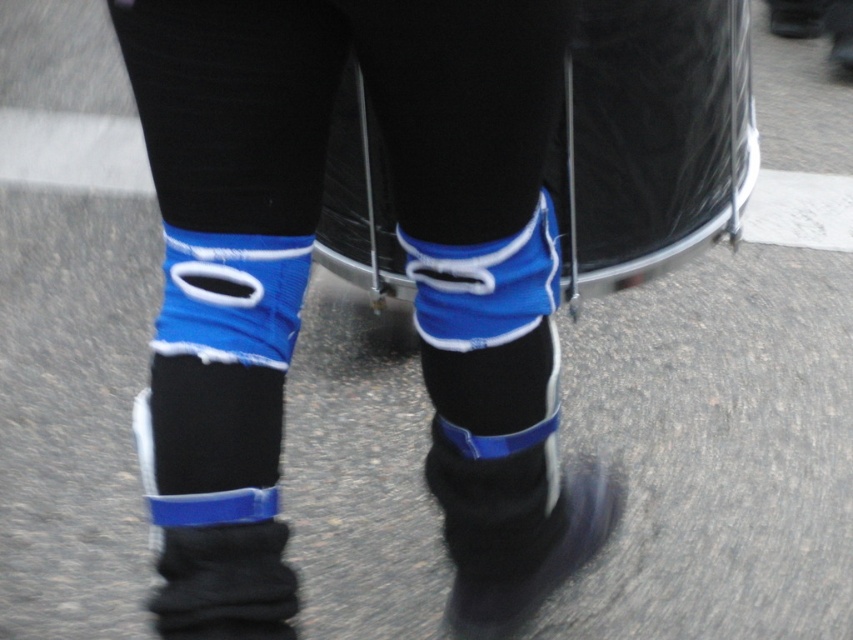
Question: Does blue fabric leg warmers at center appear on the right side of black knitted socks at lower left?

Choices:
 (A) yes
 (B) no

Answer: (A)

Question: Which point is closer to the camera taking this photo?

Choices:
 (A) (467, 368)
 (B) (577, 467)
 (C) (213, 552)

Answer: (C)

Question: Which of the following is the closest to the observer?

Choices:
 (A) blue fabric leg warmers at center
 (B) black knitted socks at lower left

Answer: (A)

Question: Does black knitted socks at lower left appear under black matte boot at lower center?

Choices:
 (A) yes
 (B) no

Answer: (B)

Question: Is blue fabric leg warmers at center to the right of black matte boot at lower center from the viewer's perspective?

Choices:
 (A) no
 (B) yes

Answer: (A)

Question: Which point is farther to the camera?

Choices:
 (A) black matte boot at lower center
 (B) black knitted socks at lower left

Answer: (A)